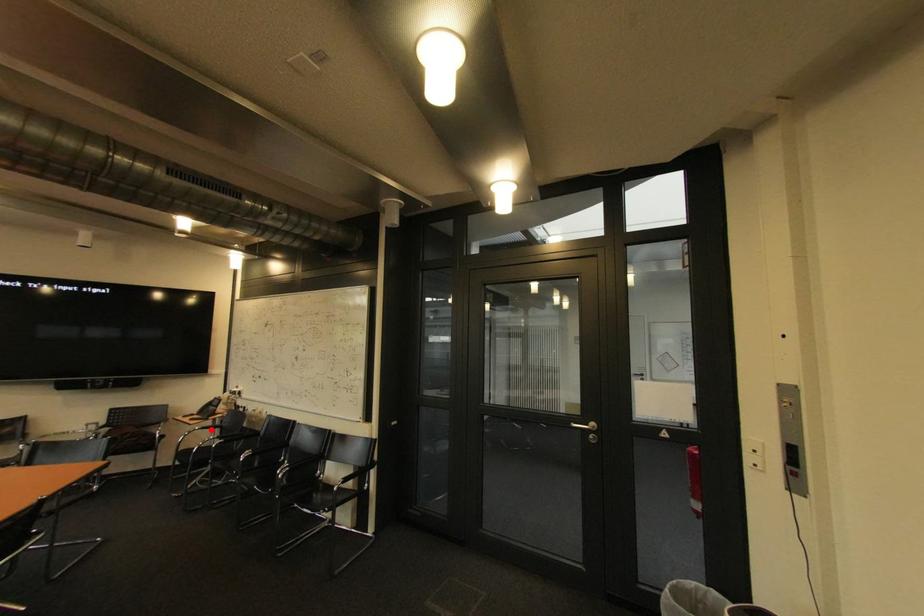
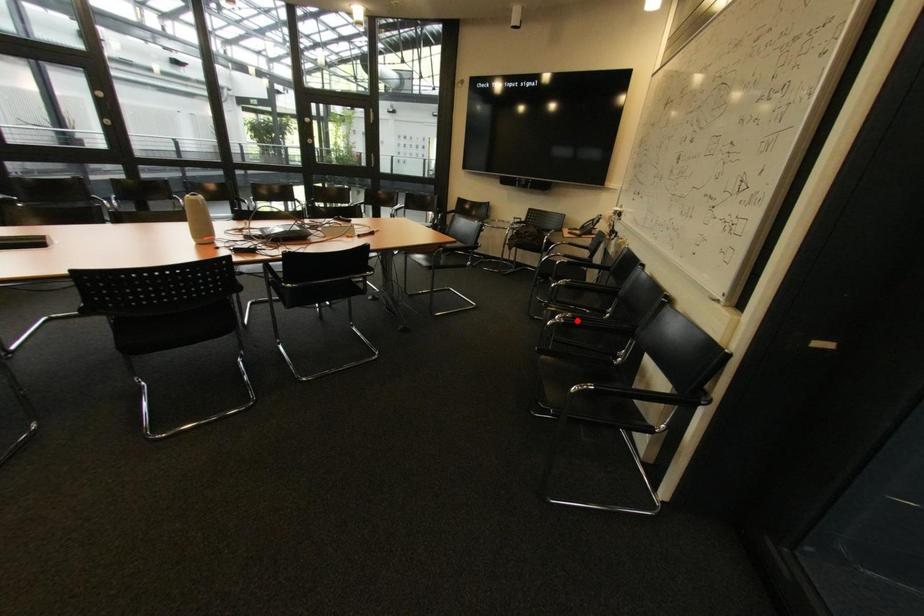
I am providing you with two images of the same scene from different viewpoints. A red point is marked on the first image and another point is marked on the second image. Is the red point in image1 aligned with the point shown in image2?

No